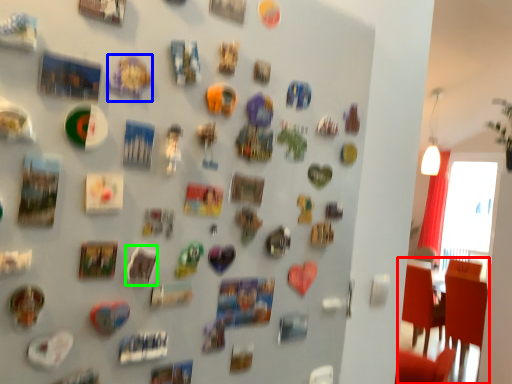
Question: Which object is the farthest from chair (highlighted by a red box)? Choose among these: art (highlighted by a blue box) or art (highlighted by a green box).

Choices:
 (A) art
 (B) art

Answer: (A)